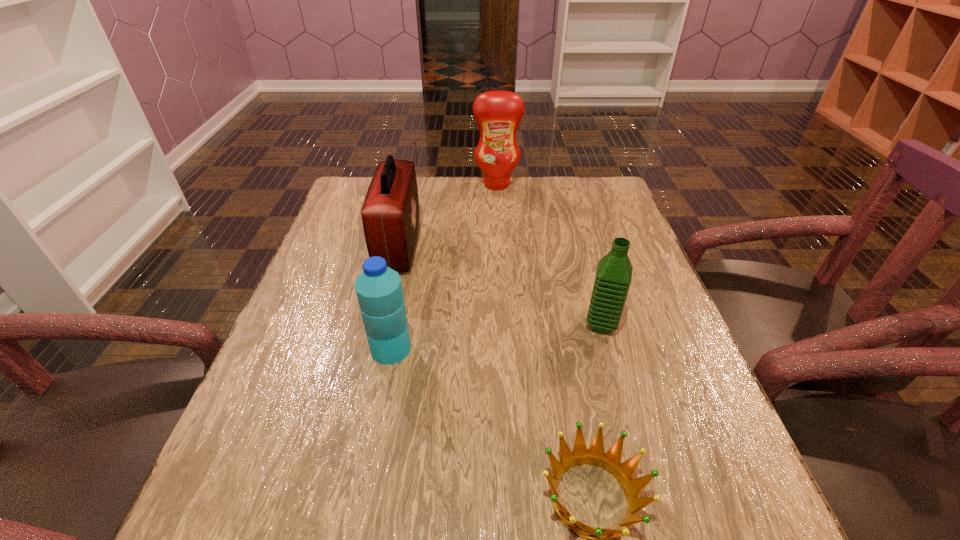
The height and width of the screenshot is (540, 960). Identify the location of free space between the right water bottle and the first aid kit. (500, 286).

This screenshot has height=540, width=960. I want to click on the second closest object relative to the crown, so click(x=379, y=291).

Where is `the second closest object to the right water bottle`? the second closest object to the right water bottle is located at coordinates (379, 291).

Find the location of a particular element. This screenshot has width=960, height=540. free location that satisfies the following two spatial constraints: 1. on the label side of the right water bottle; 2. on the left side of the condiment is located at coordinates (505, 325).

This screenshot has width=960, height=540. Identify the location of blank area in the image that satisfies the following two spatial constraints: 1. on the label side of the condiment; 2. on the left side of the right water bottle. (505, 325).